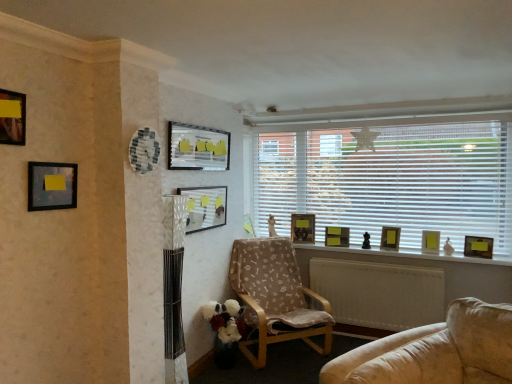
Question: From the image's perspective, is matte black picture frame at center, which is the 8th picture frame in front-to-back order, above wooden picture frame at right, which is counted as the fifth picture frame, starting from the back?

Choices:
 (A) yes
 (B) no

Answer: (A)

Question: Is matte black picture frame at center, positioned as the second picture frame in back-to-front order, wider than wooden picture frame at right, arranged as the 1th picture frame when viewed from the right?

Choices:
 (A) yes
 (B) no

Answer: (A)

Question: Is matte black picture frame at center, which is the 8th picture frame in front-to-back order, positioned before wooden picture frame at right, arranged as the 1th picture frame when viewed from the right?

Choices:
 (A) yes
 (B) no

Answer: (B)

Question: Does matte black picture frame at center, which appears as the sixth picture frame when viewed from the left, lie behind wooden picture frame at right, placed as the 9th picture frame when sorted from left to right?

Choices:
 (A) no
 (B) yes

Answer: (B)

Question: From the image's perspective, is matte black picture frame at center, positioned as the second picture frame in back-to-front order, under wooden picture frame at right, placed as the 9th picture frame when sorted from left to right?

Choices:
 (A) yes
 (B) no

Answer: (B)

Question: Are matte black picture frame at center, which is the 8th picture frame in front-to-back order, and wooden picture frame at right, the fifth picture frame positioned from the front, located far from each other?

Choices:
 (A) no
 (B) yes

Answer: (B)

Question: Is matte glass picture frame at center, arranged as the 4th picture frame when viewed from the front, not within yellow matte picture frame at window, placed as the 3th picture frame when sorted from right to left?

Choices:
 (A) no
 (B) yes

Answer: (B)

Question: Considering the relative sizes of matte glass picture frame at center, the 4th picture frame viewed from the left, and yellow matte picture frame at window, acting as the 7th picture frame starting from the front, in the image provided, is matte glass picture frame at center, the 4th picture frame viewed from the left, bigger than yellow matte picture frame at window, acting as the 7th picture frame starting from the front,?

Choices:
 (A) no
 (B) yes

Answer: (B)

Question: Is matte glass picture frame at center, which is the sixth picture frame from right to left, next to yellow matte picture frame at window, placed as the 3th picture frame when sorted from right to left, and touching it?

Choices:
 (A) no
 (B) yes

Answer: (A)

Question: Does matte glass picture frame at center, the 6th picture frame in the back-to-front sequence, have a lesser width compared to yellow matte picture frame at window, acting as the 7th picture frame starting from the front?

Choices:
 (A) no
 (B) yes

Answer: (B)

Question: Is matte glass picture frame at center, the 6th picture frame in the back-to-front sequence, facing towards yellow matte picture frame at window, acting as the 7th picture frame starting from the front?

Choices:
 (A) yes
 (B) no

Answer: (B)

Question: Can you confirm if matte glass picture frame at center, the 6th picture frame in the back-to-front sequence, is smaller than yellow matte picture frame at window, acting as the 7th picture frame starting from the front?

Choices:
 (A) no
 (B) yes

Answer: (A)

Question: From a real-world perspective, is wooden window sill at center on matte glass picture frame at center, which is the sixth picture frame from right to left?

Choices:
 (A) yes
 (B) no

Answer: (B)